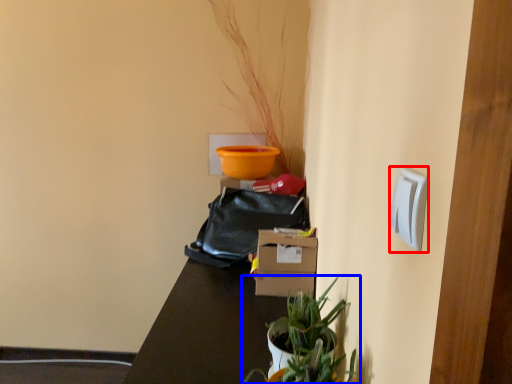
Question: Which object appears closest to the camera in this image, light switch (highlighted by a red box) or houseplant (highlighted by a blue box)?

Choices:
 (A) light switch
 (B) houseplant

Answer: (A)